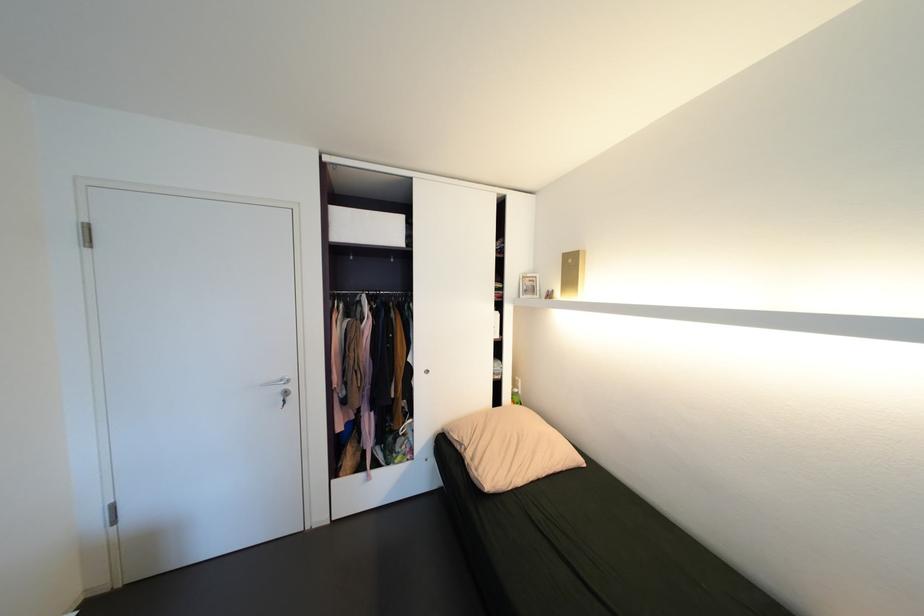
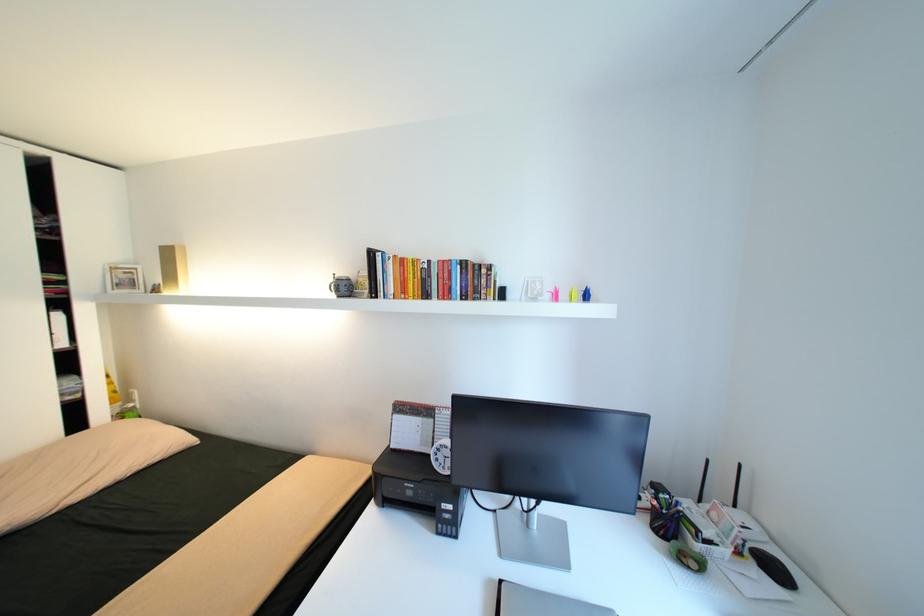
Where in the second image is the point corresponding to point 557,291 from the first image?

(164, 284)